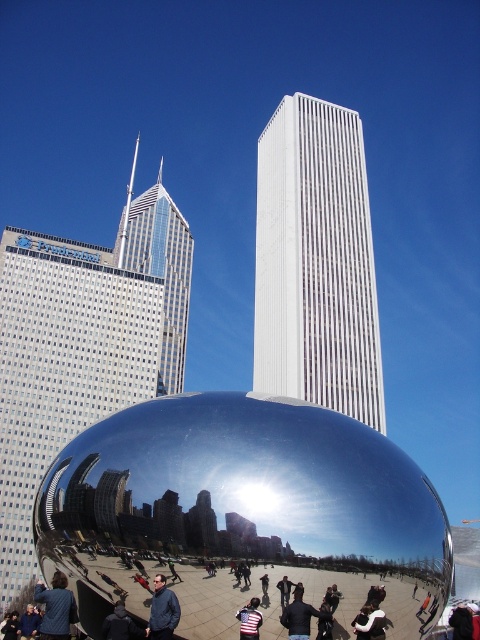
You are a photographer standing in front of the Cloud Gate sculpture in Chicago. You see a blue denim jacket at lower center and a striped shirt at center in your viewfinder. Which clothing item is closer to you?

The blue denim jacket at lower center is closer to you because it is further to the viewer than the striped shirt at center.

You are standing in front of the Cloud Gate sculpture and notice two points marked in the image. The first point is at coordinates point (300, 593) and the second is at point (255, 605). Which of these points is nearer to you?

Point (300, 593) is closer to the viewer than point (255, 605).

You are standing in front of the Cloud Gate sculpture in Chicago. You see a denim jacket at lower left. If you want to pick it up, in which direction relative to the sculpture should you move?

The denim jacket at lower left is located at point (56,608), so you should move to the lower left direction relative to the Cloud Gate sculpture to pick it up.